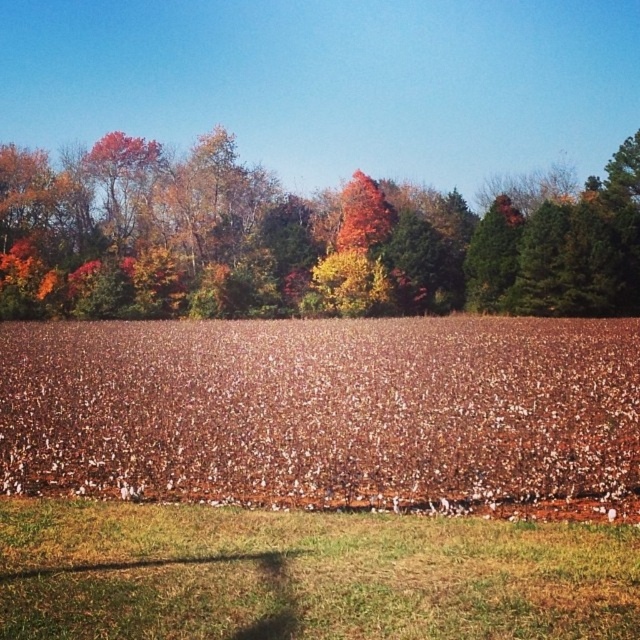
Question: Among these objects, which one is farthest from the camera?

Choices:
 (A) autumn leaves at upper center
 (B) brown grass at lower center

Answer: (A)

Question: Can you confirm if autumn leaves at upper center is positioned to the left of brown grass at lower center?

Choices:
 (A) no
 (B) yes

Answer: (A)

Question: Among these objects, which one is farthest from the camera?

Choices:
 (A) brown grass at lower center
 (B) autumn leaves at upper center

Answer: (B)

Question: Does autumn leaves at upper center lie behind brown grass at lower center?

Choices:
 (A) no
 (B) yes

Answer: (B)

Question: Can you confirm if autumn leaves at upper center is wider than brown grass at lower center?

Choices:
 (A) no
 (B) yes

Answer: (B)